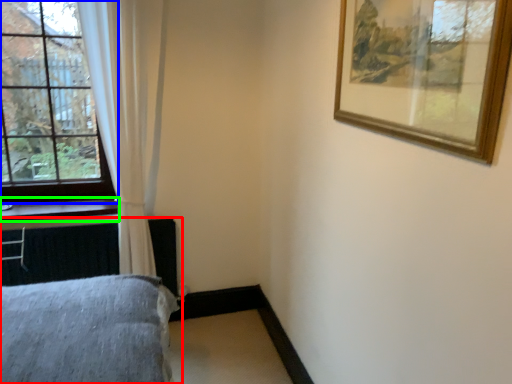
Question: Considering the real-world distances, which object is farthest from bed (highlighted by a red box)? window (highlighted by a blue box) or window sill (highlighted by a green box)?

Choices:
 (A) window
 (B) window sill

Answer: (A)